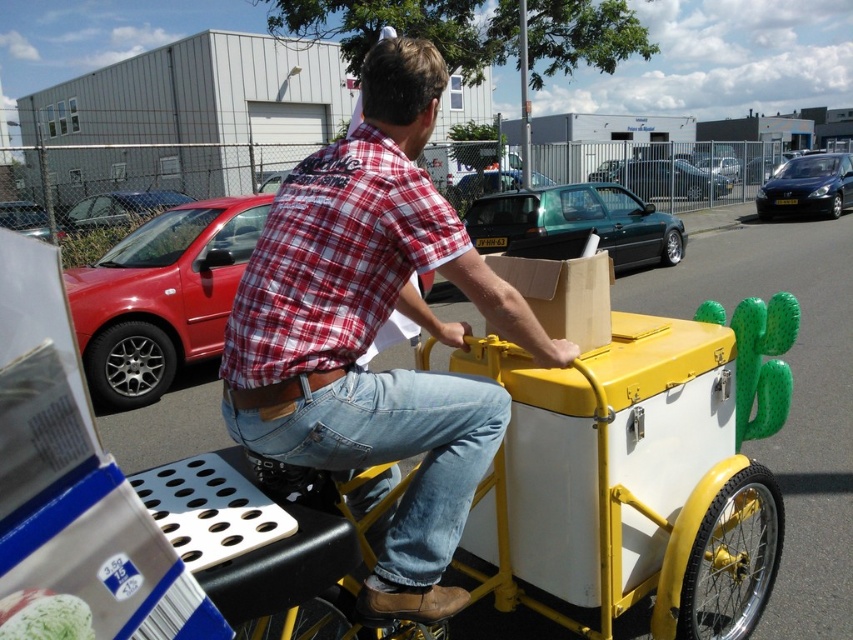
Can you confirm if matte red car at left is shorter than metallic blue car at right?

No.

Which is behind, point (422, 276) or point (769, 198)?

The point (769, 198) is behind.

At what (x,y) coordinates should I click in order to perform the action: click on matte red car at left. Please return your answer as a coordinate pair (x, y). This screenshot has width=853, height=640. Looking at the image, I should click on (161, 296).

From the picture: Does matte red car at left appear under metallic red car at left?

Indeed, matte red car at left is positioned under metallic red car at left.

Does matte red car at left have a smaller size compared to metallic red car at left?

No.

Is point (120, 314) less distant than point (86, 214)?

Yes, point (120, 314) is closer to viewer.

Identify the location of matte red car at left. This screenshot has width=853, height=640. tap(161, 296).

Describe the element at coordinates (374, 332) in the screenshot. The height and width of the screenshot is (640, 853). I see `matte red plaid shirt at center` at that location.

Is matte red plaid shirt at center below metallic red car at left?

Yes, matte red plaid shirt at center is below metallic red car at left.

Between point (424, 205) and point (160, 205), which one is positioned behind?

The point (160, 205) is more distant.

Identify the location of matte red plaid shirt at center. The height and width of the screenshot is (640, 853). (374, 332).